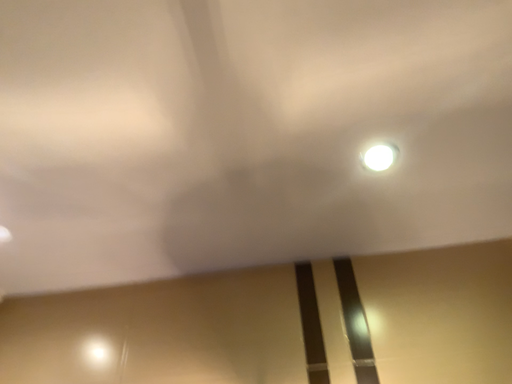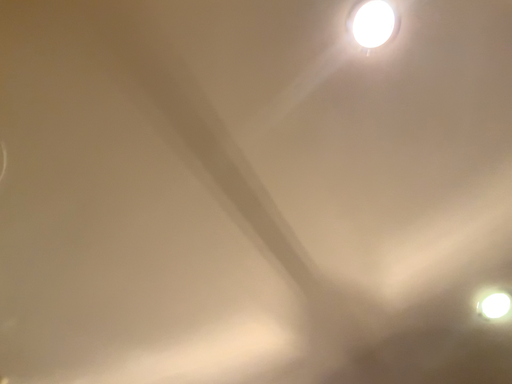
Question: How did the camera likely rotate when shooting the video?

Choices:
 (A) rotated downward
 (B) rotated upward

Answer: (B)